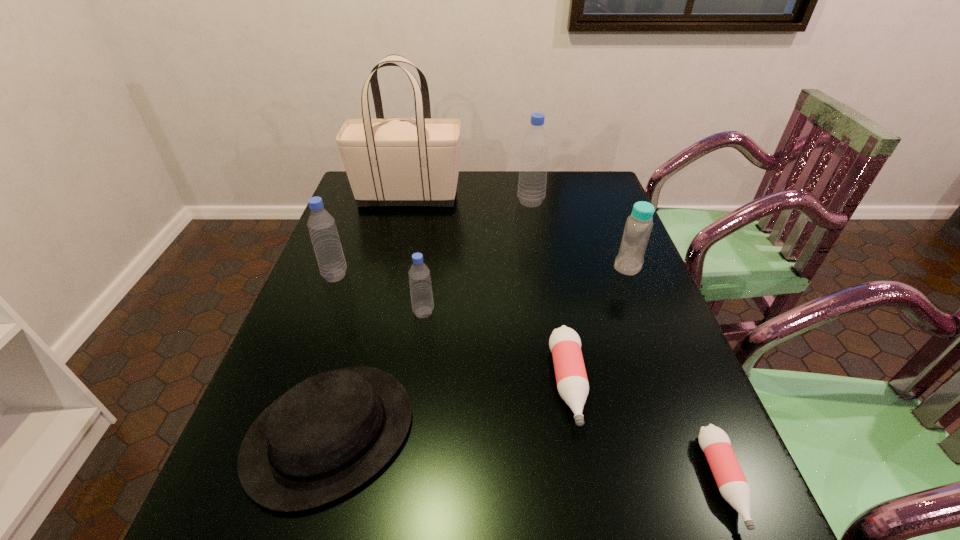
Identify the location of object that is at the near left corner. The image size is (960, 540). pyautogui.click(x=326, y=436).

Where is `object present at the near right corner`? object present at the near right corner is located at coordinates (x=714, y=442).

The height and width of the screenshot is (540, 960). I want to click on free space at the far edge, so click(x=480, y=174).

Image resolution: width=960 pixels, height=540 pixels. I want to click on free region at the near edge of the desktop, so click(x=422, y=517).

The image size is (960, 540). Identify the location of blank area at the left edge. (372, 246).

The width and height of the screenshot is (960, 540). What are the coordinates of `vacant space at the right edge of the desktop` in the screenshot? It's located at (652, 399).

The height and width of the screenshot is (540, 960). Find the location of `free location at the far right corner of the desktop`. free location at the far right corner of the desktop is located at coordinates (571, 188).

Locate an element on the screen. vacant space that is in between the farthest bottle and the right pink bottle is located at coordinates (627, 342).

Find the location of a particular element. The image size is (960, 540). blank region between the third nearest bottle and the rightmost blue bottle is located at coordinates (526, 289).

Identify the location of free space between the second biggest blue bottle and the shopping bag. This screenshot has width=960, height=540. click(372, 236).